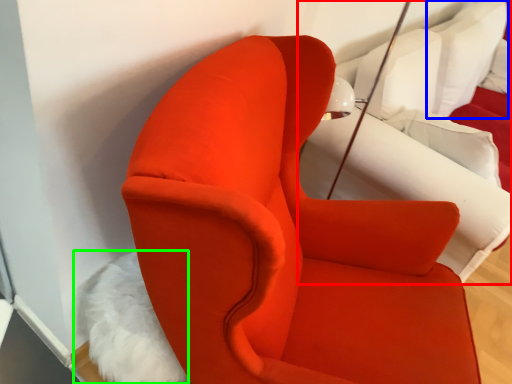
Question: Which object is positioned farthest from bed (highlighted by a red box)? Select from pillow (highlighted by a blue box) and animal (highlighted by a green box).

Choices:
 (A) pillow
 (B) animal

Answer: (B)